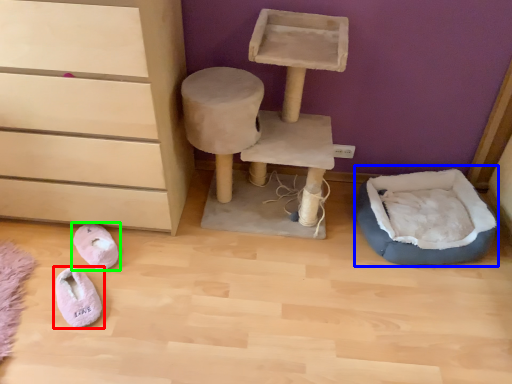
Question: Considering the real-world distances, which object is closest to footwear (highlighted by a red box)? bean bag chair (highlighted by a blue box) or footwear (highlighted by a green box).

Choices:
 (A) bean bag chair
 (B) footwear

Answer: (B)